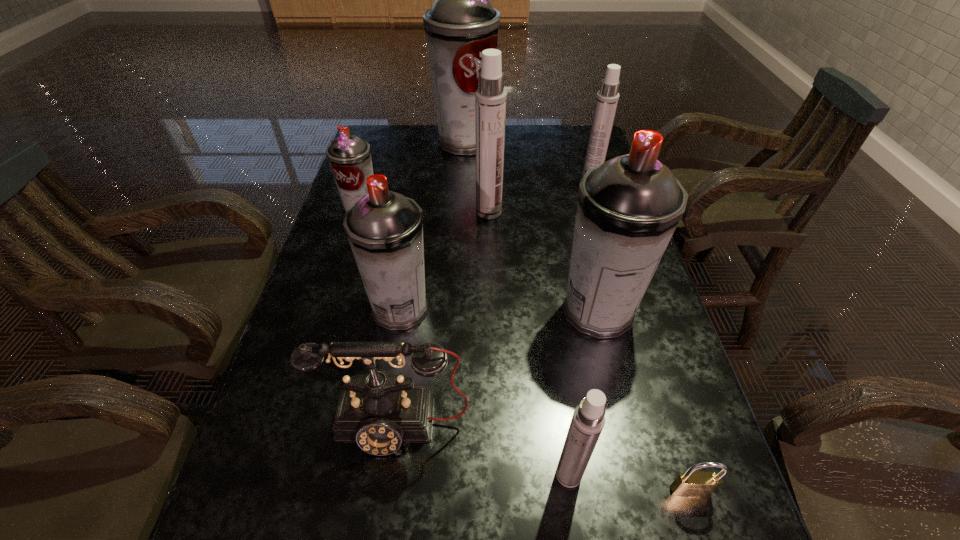
This screenshot has height=540, width=960. In order to click on the nearest aerosol can in this screenshot , I will do `click(588, 420)`.

What are the coordinates of `the second white aerosol can from right to left` in the screenshot? It's located at 588,420.

The image size is (960, 540). I want to click on telephone, so click(378, 410).

I want to click on black telephone, so click(x=378, y=410).

Find the location of a particular element. The height and width of the screenshot is (540, 960). the shortest object is located at coordinates (687, 484).

Identify the location of padlock. (687, 484).

The width and height of the screenshot is (960, 540). I want to click on vacant region located on the front of the farthest object, so click(461, 235).

This screenshot has width=960, height=540. What are the coordinates of `free space located 0.250m on the front of the leftmost white aerosol can` in the screenshot? It's located at (491, 283).

At what (x,y) coordinates should I click in order to perform the action: click on free space located on the left of the second biggest gray aerosol can. Please return your answer as a coordinate pair (x, y). Looking at the image, I should click on (405, 312).

In order to click on free space located 0.070m on the front of the farthest white aerosol can in this screenshot , I will do `click(596, 201)`.